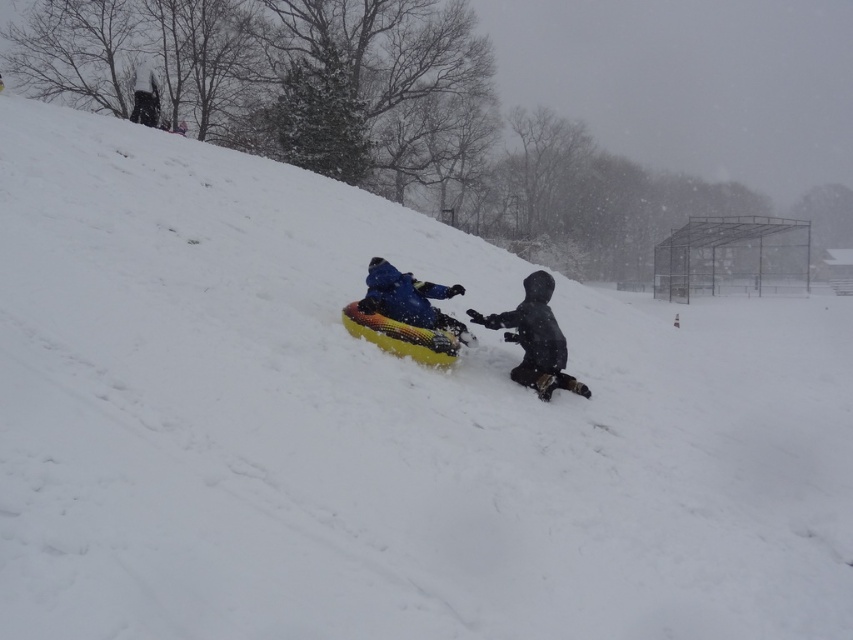
You are trying to locate two people in the snowy scene. The black matte snowsuit at lower right and the blue fabric jacket at center are both visible. Which one is positioned more towards the right side of the image?

The black matte snowsuit at lower right is positioned more towards the right side of the image compared to the blue fabric jacket at center.

You are standing in the snowy scene and want to place a small flag exactly halfway between point (492, 314) and point (381, 307). Will the flag be closer to the camera or farther away compared to the average depth of the two points?

The flag placed halfway between point (492, 314) and point (381, 307) will be closer to the camera than the average depth of the two points because point (492, 314) is further to the camera than point (381, 307).